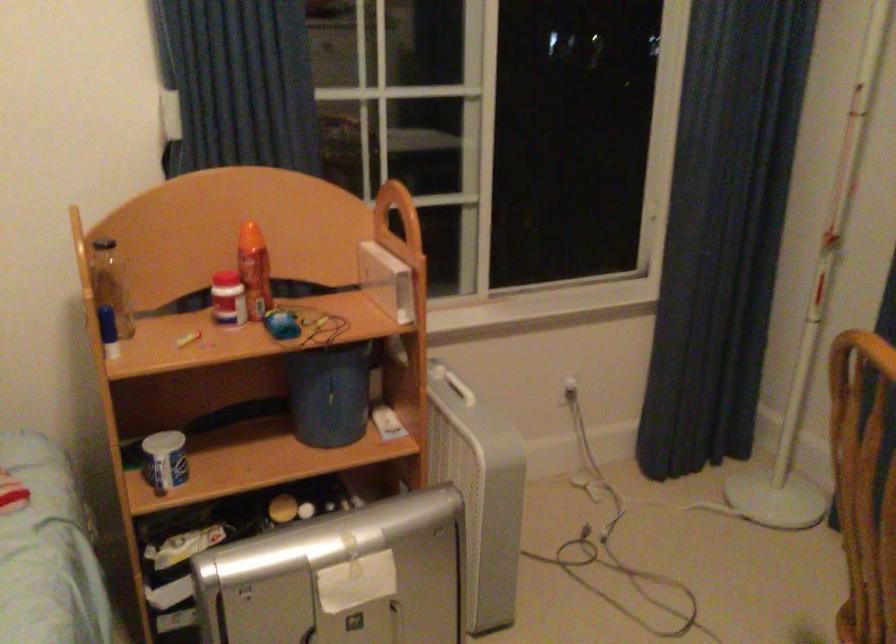
Find where to lift the red and white bottle. Please return your answer as a coordinate pair (x, y).

(254, 270)